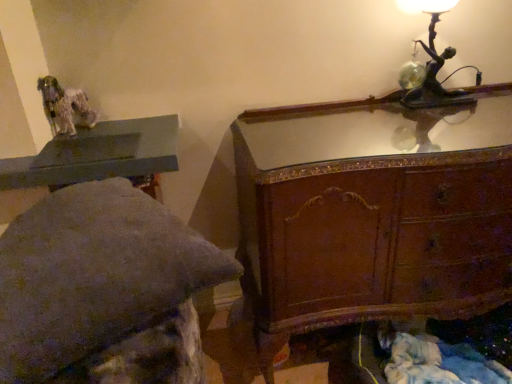
In order to face matte gray table at upper left, should I rotate leftwards or rightwards?

Turn left by 22.491 degrees to look at matte gray table at upper left.

The width and height of the screenshot is (512, 384). I want to click on bronze metallic table lamp at upper right, so click(434, 66).

Locate an element on the screen. This screenshot has width=512, height=384. wooden chest of drawers at upper right is located at coordinates click(373, 212).

Image resolution: width=512 pixels, height=384 pixels. What do you see at coordinates (373, 212) in the screenshot? I see `wooden chest of drawers at upper right` at bounding box center [373, 212].

The width and height of the screenshot is (512, 384). Identify the location of matte gray table at upper left. (98, 154).

Between matte gray stone bench at upper left and matte gray table at upper left, which one appears on the left side from the viewer's perspective?

matte gray table at upper left is more to the left.

Find the location of `furniture below the matte gray table at upper left (from the image's perspective)`. furniture below the matte gray table at upper left (from the image's perspective) is located at coordinates (103, 290).

From the picture: Considering the sizes of objects matte gray stone bench at upper left and matte gray table at upper left in the image provided, who is smaller, matte gray stone bench at upper left or matte gray table at upper left?

With smaller size is matte gray table at upper left.

Considering the relative sizes of matte gray stone bench at upper left and matte gray table at upper left in the image provided, is matte gray stone bench at upper left shorter than matte gray table at upper left?

No.

How far apart are bronze metallic table lamp at upper right and matte gray stone bench at upper left?

bronze metallic table lamp at upper right and matte gray stone bench at upper left are 1.21 meters apart from each other.

Considering the relative positions of bronze metallic table lamp at upper right and matte gray stone bench at upper left in the image provided, is bronze metallic table lamp at upper right to the left of matte gray stone bench at upper left from the viewer's perspective?

In fact, bronze metallic table lamp at upper right is to the right of matte gray stone bench at upper left.

Is bronze metallic table lamp at upper right oriented towards matte gray stone bench at upper left?

No, bronze metallic table lamp at upper right is not aimed at matte gray stone bench at upper left.

Would you say matte gray stone bench at upper left is part of bronze metallic table lamp at upper right's contents?

Definitely not — matte gray stone bench at upper left is not inside bronze metallic table lamp at upper right.

Is matte gray table at upper left turned away from matte gray stone bench at upper left?

That's not correct — matte gray table at upper left is not looking away from matte gray stone bench at upper left.

From the image's perspective, is matte gray table at upper left below matte gray stone bench at upper left?

No, from the image's perspective, matte gray table at upper left is not beneath matte gray stone bench at upper left.

How distant is matte gray table at upper left from matte gray stone bench at upper left?

They are 42.72 centimeters apart.

Find the location of a particular element. The height and width of the screenshot is (384, 512). furniture above the matte gray table at upper left (from a real-world perspective) is located at coordinates (103, 290).

Is matte gray stone bench at upper left far away from wooden chest of drawers at upper right?

matte gray stone bench at upper left is near wooden chest of drawers at upper right, not far away.

Between matte gray stone bench at upper left and wooden chest of drawers at upper right, which one has less height?

With less height is matte gray stone bench at upper left.

Considering the points (77, 321) and (414, 244), which point is in front, point (77, 321) or point (414, 244)?

Point (77, 321)

This screenshot has width=512, height=384. I want to click on chest of drawers on the right of matte gray stone bench at upper left, so click(x=373, y=212).

Which of these two, wooden chest of drawers at upper right or matte gray table at upper left, is smaller?

matte gray table at upper left is smaller.

Locate an element on the screen. This screenshot has height=384, width=512. table located behind the wooden chest of drawers at upper right is located at coordinates (98, 154).

From the image's perspective, would you say wooden chest of drawers at upper right is shown under matte gray table at upper left?

Indeed, from the image's perspective, wooden chest of drawers at upper right is shown beneath matte gray table at upper left.

Considering the sizes of objects wooden chest of drawers at upper right and matte gray table at upper left in the image provided, who is shorter, wooden chest of drawers at upper right or matte gray table at upper left?

matte gray table at upper left is shorter.

Looking at this image, measure the distance between wooden chest of drawers at upper right and matte gray stone bench at upper left.

60.77 centimeters.

Does wooden chest of drawers at upper right contain matte gray stone bench at upper left?

No, matte gray stone bench at upper left is not a part of wooden chest of drawers at upper right.

Between wooden chest of drawers at upper right and matte gray stone bench at upper left, which one is positioned in front?

matte gray stone bench at upper left is in front.

In the scene shown: Is bronze metallic table lamp at upper right positioned in front of matte gray table at upper left?

No, the depth of bronze metallic table lamp at upper right is greater than that of matte gray table at upper left.

From a real-world perspective, is bronze metallic table lamp at upper right physically above matte gray table at upper left?

Indeed, from a real-world perspective, bronze metallic table lamp at upper right stands above matte gray table at upper left.

Is bronze metallic table lamp at upper right with matte gray table at upper left?

No.

From the image's perspective, is bronze metallic table lamp at upper right located above matte gray table at upper left?

Correct, bronze metallic table lamp at upper right appears higher than matte gray table at upper left in the image.

Locate an element on the screen. This screenshot has height=384, width=512. furniture below the matte gray table at upper left (from the image's perspective) is located at coordinates (103, 290).

The height and width of the screenshot is (384, 512). Identify the location of furniture directly beneath the bronze metallic table lamp at upper right (from a real-world perspective). (103, 290).

Looking at the image, which one is located closer to wooden chest of drawers at upper right, bronze metallic table lamp at upper right or matte gray table at upper left?

Among the two, bronze metallic table lamp at upper right is located nearer to wooden chest of drawers at upper right.

When comparing their distances from wooden chest of drawers at upper right, does bronze metallic table lamp at upper right or matte gray stone bench at upper left seem closer?

bronze metallic table lamp at upper right lies closer to wooden chest of drawers at upper right than the other object.

Based on their spatial positions, is matte gray table at upper left or bronze metallic table lamp at upper right further from wooden chest of drawers at upper right?

matte gray table at upper left is positioned further to the anchor wooden chest of drawers at upper right.

When comparing their distances from bronze metallic table lamp at upper right, does matte gray stone bench at upper left or wooden chest of drawers at upper right seem closer?

wooden chest of drawers at upper right lies closer to bronze metallic table lamp at upper right than the other object.

When comparing their distances from matte gray table at upper left, does bronze metallic table lamp at upper right or wooden chest of drawers at upper right seem closer?

wooden chest of drawers at upper right.

Estimate the real-world distances between objects in this image. Which object is further from matte gray table at upper left, wooden chest of drawers at upper right or bronze metallic table lamp at upper right?

bronze metallic table lamp at upper right is further to matte gray table at upper left.

Looking at this image, considering their positions, is matte gray stone bench at upper left positioned further to matte gray table at upper left than wooden chest of drawers at upper right?

wooden chest of drawers at upper right is further to matte gray table at upper left.

When comparing their distances from bronze metallic table lamp at upper right, does matte gray stone bench at upper left or matte gray table at upper left seem further?

matte gray stone bench at upper left.

Find the location of a particular element. The width and height of the screenshot is (512, 384). furniture between matte gray table at upper left and wooden chest of drawers at upper right is located at coordinates (103, 290).

The height and width of the screenshot is (384, 512). I want to click on chest of drawers between matte gray table at upper left and bronze metallic table lamp at upper right, so point(373,212).

The width and height of the screenshot is (512, 384). Find the location of `the chest of drawers located between matte gray stone bench at upper left and bronze metallic table lamp at upper right in the left-right direction`. the chest of drawers located between matte gray stone bench at upper left and bronze metallic table lamp at upper right in the left-right direction is located at coordinates (373, 212).

The image size is (512, 384). In order to click on furniture between matte gray table at upper left and bronze metallic table lamp at upper right from left to right in this screenshot , I will do `click(103, 290)`.